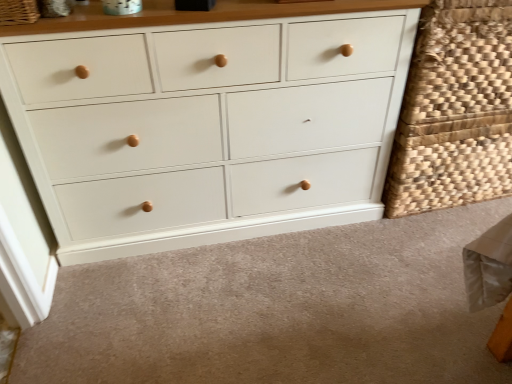
Question: Looking at their shapes, would you say woven natural fiber basket at upper left, positioned as the 2th basket in right-to-left order, is wider or thinner than woven natural basket at right, marked as the 1th basket in a right-to-left arrangement?

Choices:
 (A) thin
 (B) wide

Answer: (A)

Question: Considering their positions, is woven natural fiber basket at upper left, acting as the 2th basket starting from the back, located in front of or behind woven natural basket at right, marked as the second basket in a left-to-right arrangement?

Choices:
 (A) behind
 (B) front

Answer: (B)

Question: Estimate the real-world distances between objects in this image. Which object is closer to the white painted wood chest of drawers at center?

Choices:
 (A) white matte drawer at lower center
 (B) woven natural basket at right, which is the 1th basket from back to front
 (C) woven natural fiber basket at upper left, acting as the 2th basket starting from the back

Answer: (A)

Question: Considering the real-world distances, which object is farthest from the white painted wood chest of drawers at center?

Choices:
 (A) white matte drawer at lower center
 (B) woven natural basket at right, marked as the 1th basket in a right-to-left arrangement
 (C) woven natural fiber basket at upper left, marked as the 1th basket in a left-to-right arrangement

Answer: (C)